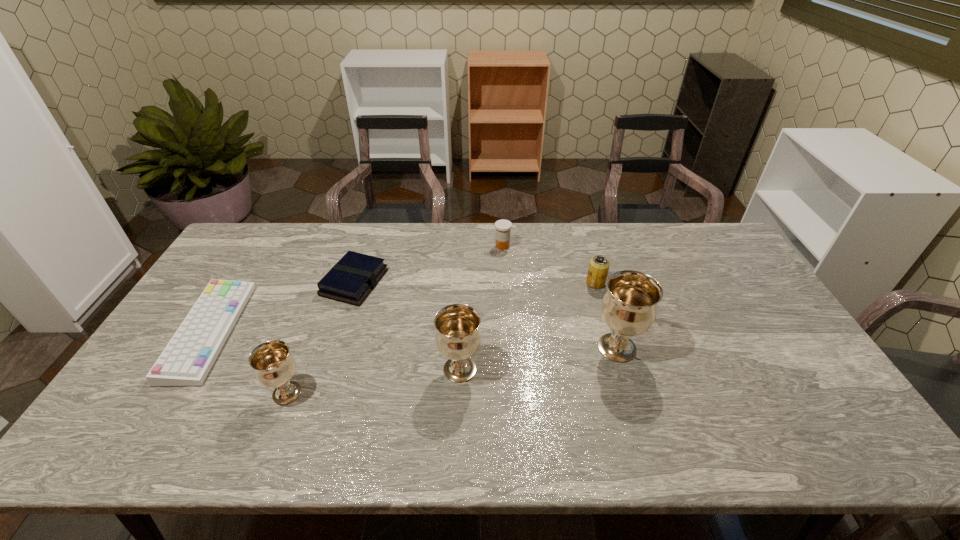
The chalices are evenly distributed in the image. To maintain this, where would you place another chalice on the right? Please point to a free space. Please provide its 2D coordinates. Your answer should be formatted as a tuple, i.e. [(x, y)], where the tuple contains the x and y coordinates of a point satisfying the conditions above.

[(760, 328)]